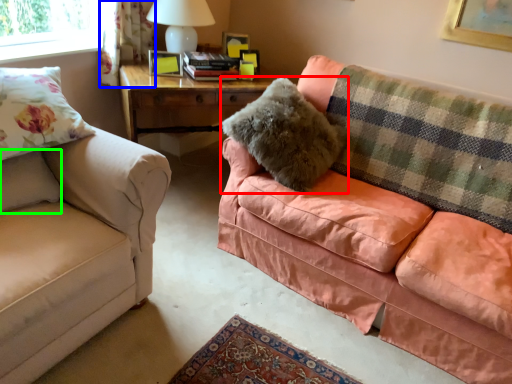
Question: Based on their relative distances, which object is farther from pillow (highlighted by a red box)? Choose from curtain (highlighted by a blue box) and pillow (highlighted by a green box).

Choices:
 (A) curtain
 (B) pillow

Answer: (A)